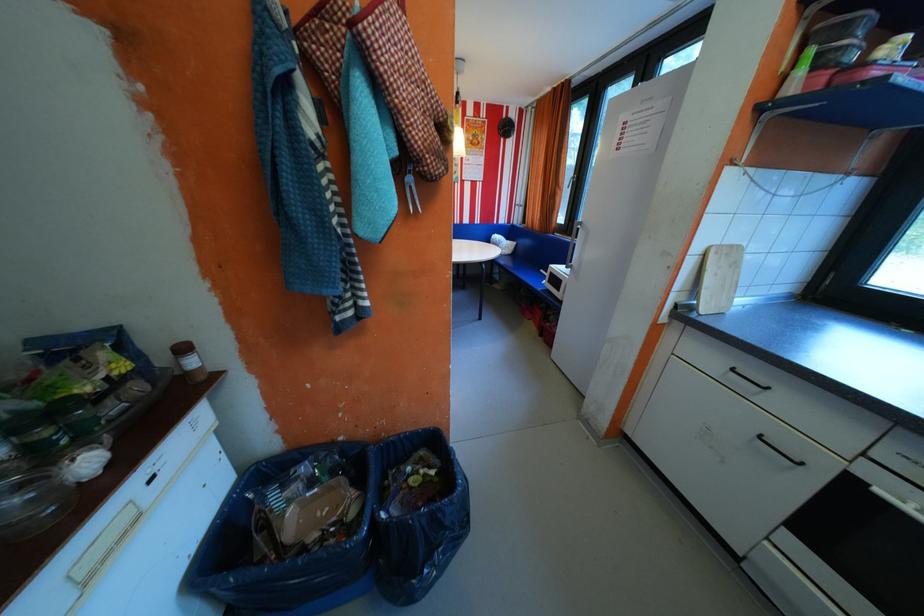
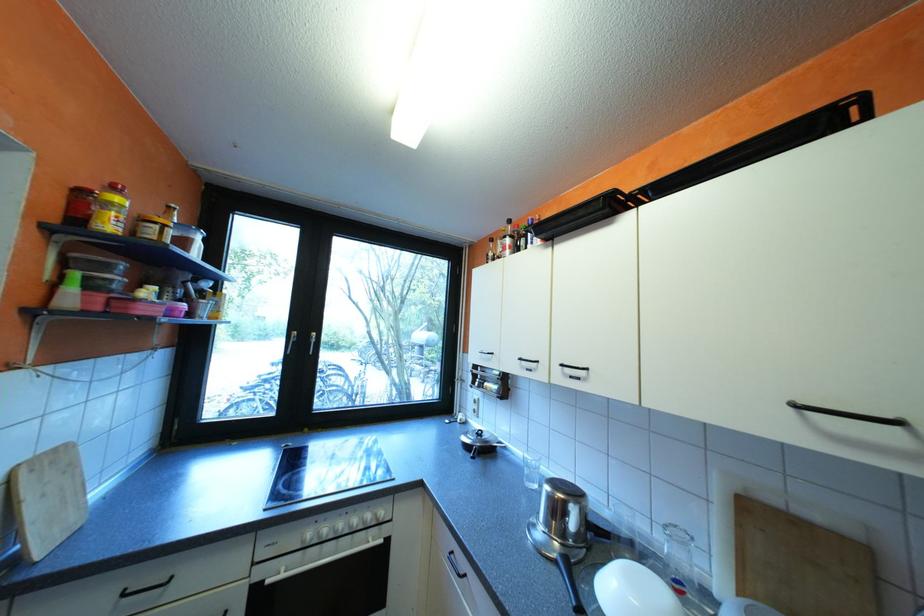
Find the pixel in the second image that matches (744,368) in the first image.

(136, 593)